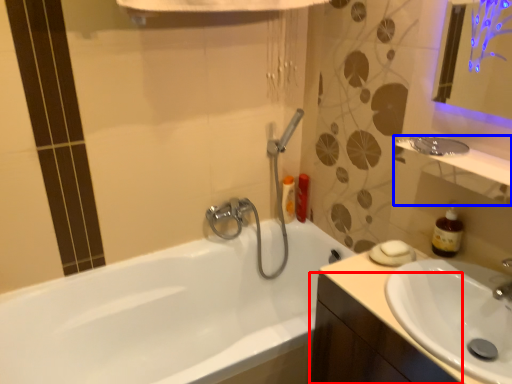
Question: Which of the following is the farthest to the observer, cabinetry (highlighted by a red box) or balustrade (highlighted by a blue box)?

Choices:
 (A) cabinetry
 (B) balustrade

Answer: (B)